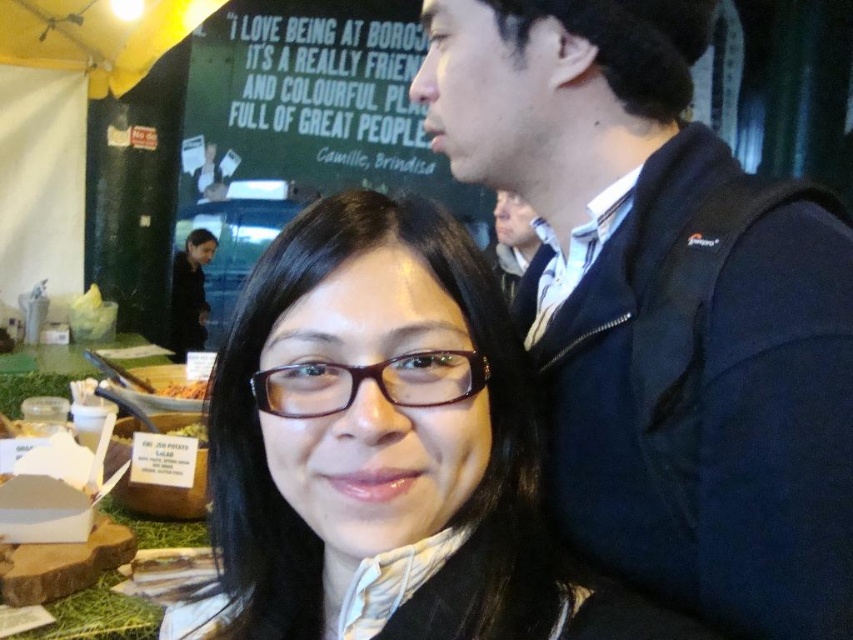
Which is below, dark blue jacket at upper right or wooden bowl at center?

wooden bowl at center is below.

Locate an element on the screen. The height and width of the screenshot is (640, 853). dark blue jacket at upper right is located at coordinates (663, 307).

In order to click on dark blue jacket at upper right in this screenshot , I will do `click(663, 307)`.

Locate an element on the screen. This screenshot has height=640, width=853. dark blue jacket at upper right is located at coordinates (663, 307).

Can you confirm if brown matte glasses at center is smaller than matte black jacket at upper right?

Indeed, brown matte glasses at center has a smaller size compared to matte black jacket at upper right.

Is brown matte glasses at center closer to camera compared to matte black jacket at upper right?

That is True.

Does point (286, 264) come in front of point (498, 214)?

Yes, point (286, 264) is closer to viewer.

The image size is (853, 640). What are the coordinates of `brown matte glasses at center` in the screenshot? It's located at (381, 445).

Identify the location of matte black jacket at upper right. Image resolution: width=853 pixels, height=640 pixels. (512, 240).

Which is behind, point (515, 269) or point (189, 387)?

Point (515, 269)

Who is more distant from viewer, (502, 237) or (173, 392)?

The point (502, 237) is more distant.

Locate an element on the screen. This screenshot has height=640, width=853. matte black jacket at upper right is located at coordinates point(512,240).